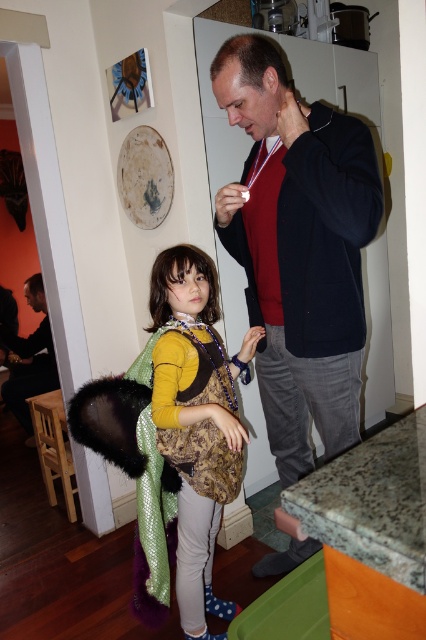
You are a fashion designer observing two people in a kitchen scene. The dark blue sweater at center is worn by a man, and the dark brown leather jacket at left is worn by a girl in a costume. Which clothing item is taller?

The dark blue sweater at center is much taller than the dark brown leather jacket at left.